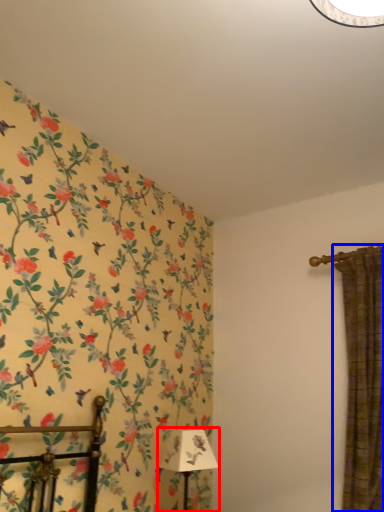
Question: Which object appears closest to the camera in this image, table lamp (highlighted by a red box) or curtain (highlighted by a blue box)?

Choices:
 (A) table lamp
 (B) curtain

Answer: (B)